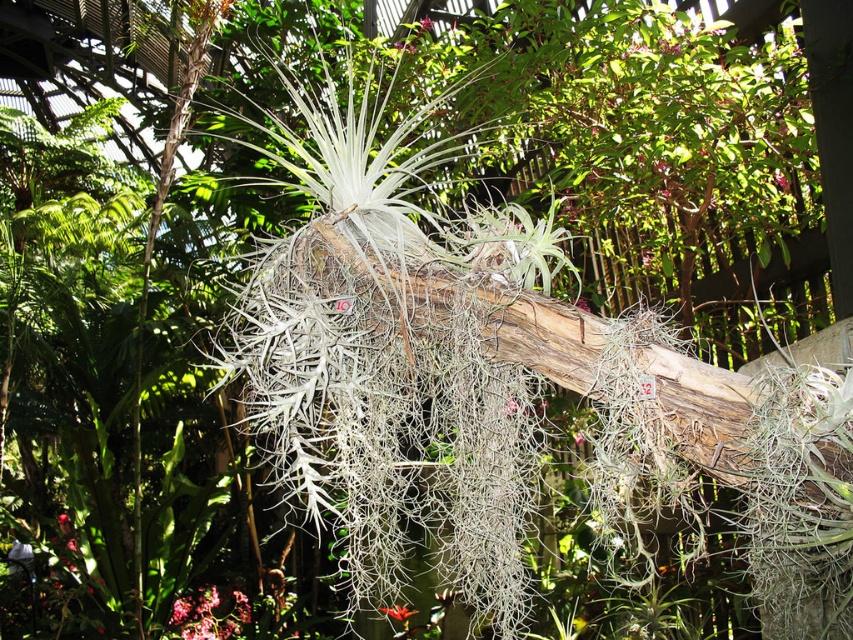
You are a botanist examining the image of the tropical greenhouse. You notice a specific point at coordinates point (207, 614). Based on the image, what object is this point located on?

The point (207, 614) is located on the pink matte flower at lower left.

You are a gardener who wants to plant a new flower in the greenhouse. You have a pot that can only accommodate flowers wider than 10 cm. Based on the image, can you determine if the pink matte flower at lower left or the orange matte flower at center would fit in the pot?

The pink matte flower at lower left might be wider than orange matte flower at center, so it could fit in the pot if it exceeds 10 cm. However, the exact width is uncertain without precise measurements.